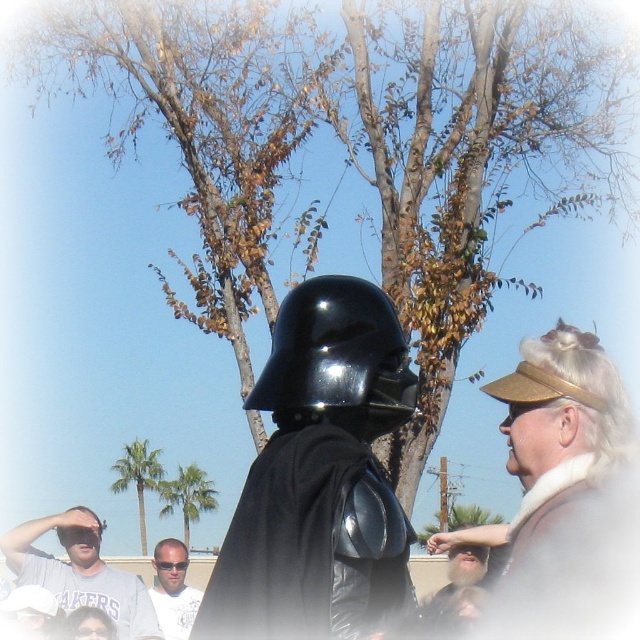
Does point (72, 604) lie behind point (156, 612)?

No, (72, 604) is in front of (156, 612).

This screenshot has height=640, width=640. What do you see at coordinates (81, 572) in the screenshot?
I see `gray cotton t-shirt at lower left` at bounding box center [81, 572].

This screenshot has height=640, width=640. In order to click on gray cotton t-shirt at lower left in this screenshot , I will do `click(81, 572)`.

Is black leather cape at center closer to the viewer compared to beige fabric hat at lower right?

Yes, black leather cape at center is closer to the viewer.

Where is `black leather cape at center`? This screenshot has width=640, height=640. black leather cape at center is located at coordinates (310, 545).

The height and width of the screenshot is (640, 640). Identify the location of black leather cape at center. (310, 545).

Where is `black leather cape at center`? This screenshot has height=640, width=640. black leather cape at center is located at coordinates (310, 545).

How distant is brown leather hat at upper right from light brown hair at center?

brown leather hat at upper right and light brown hair at center are 18.52 meters apart from each other.

Is point (579, 387) positioned before point (179, 577)?

Yes, it is in front of point (179, 577).

The height and width of the screenshot is (640, 640). Describe the element at coordinates (554, 438) in the screenshot. I see `brown leather hat at upper right` at that location.

I want to click on brown leather hat at upper right, so click(x=554, y=438).